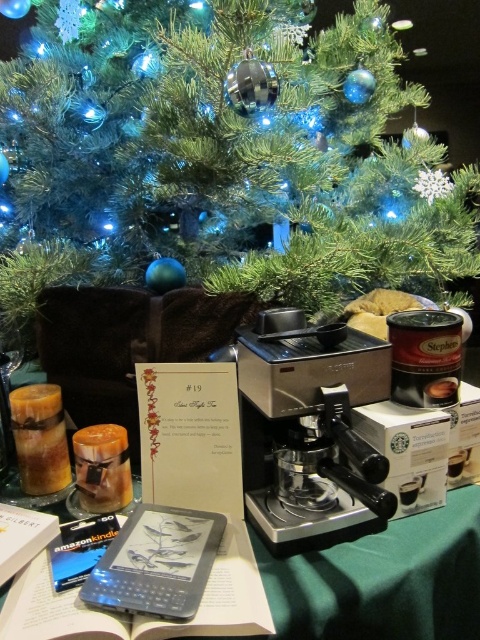
Is the position of metallic silver espresso machine at center less distant than that of hardcover book at center?

That is False.

Between metallic silver espresso machine at center and hardcover book at center, which one appears on the left side from the viewer's perspective?

Positioned to the left is hardcover book at center.

Between point (299, 570) and point (227, 525), which one is positioned behind?

The point (227, 525) is more distant.

Where is `metallic silver espresso machine at center`? metallic silver espresso machine at center is located at coordinates (384, 580).

Where is `sleek metallic coffee machine at center`? The height and width of the screenshot is (640, 480). sleek metallic coffee machine at center is located at coordinates (309, 432).

Is sleek metallic coffee machine at center smaller than green matte christmas tree at upper center?

Correct, sleek metallic coffee machine at center occupies less space than green matte christmas tree at upper center.

Is point (391, 509) more distant than point (464, 72)?

No, it is not.

Locate an element on the screen. The width and height of the screenshot is (480, 640). sleek metallic coffee machine at center is located at coordinates (309, 432).

Looking at this image, does sleek metallic coffee machine at center appear on the right side of hardcover book at center?

Correct, you'll find sleek metallic coffee machine at center to the right of hardcover book at center.

Is sleek metallic coffee machine at center positioned at the back of hardcover book at center?

Yes, sleek metallic coffee machine at center is behind hardcover book at center.

Is point (279, 369) more distant than point (85, 618)?

Yes, it is.

The width and height of the screenshot is (480, 640). In order to click on sleek metallic coffee machine at center in this screenshot , I will do `click(309, 432)`.